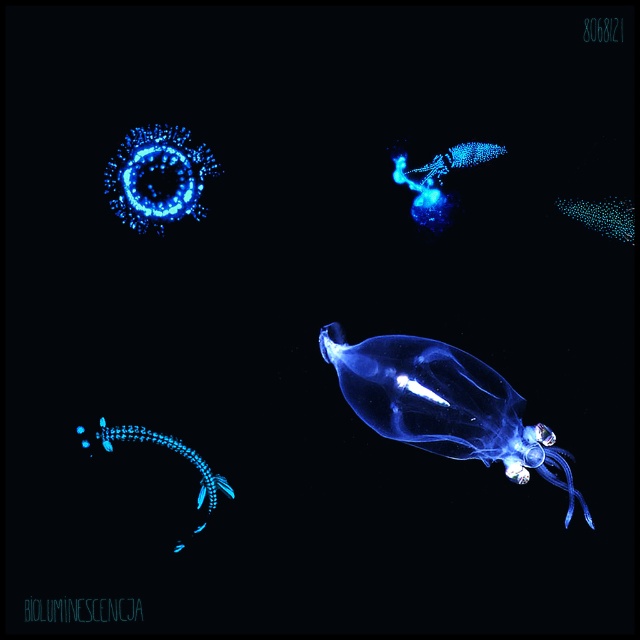
Where is `transparent gelatinous at center`? transparent gelatinous at center is located at coordinates (444, 404).

Is transparent gelatinous at center thinner than glowing blue translucent jellyfish at bottom left?

In fact, transparent gelatinous at center might be wider than glowing blue translucent jellyfish at bottom left.

Which is in front, point (356, 356) or point (212, 499)?

Positioned in front is point (212, 499).

Where is `transparent gelatinous at center`? This screenshot has width=640, height=640. transparent gelatinous at center is located at coordinates (444, 404).